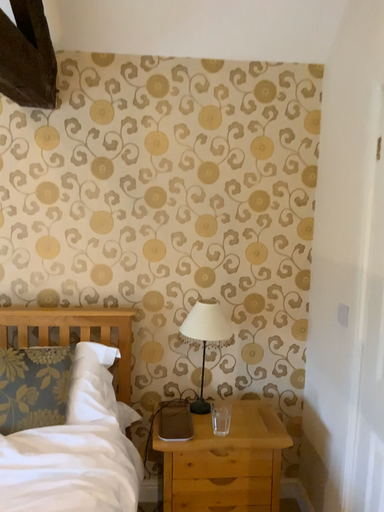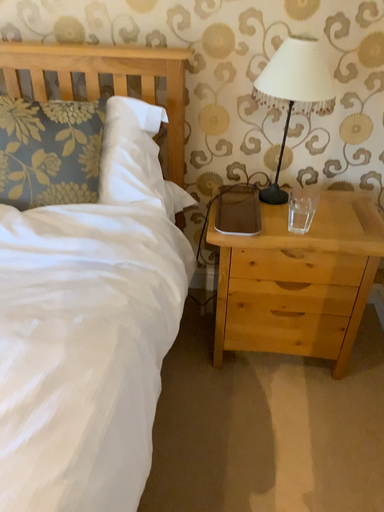
Question: How did the camera likely rotate when shooting the video?

Choices:
 (A) rotated right
 (B) rotated left

Answer: (B)